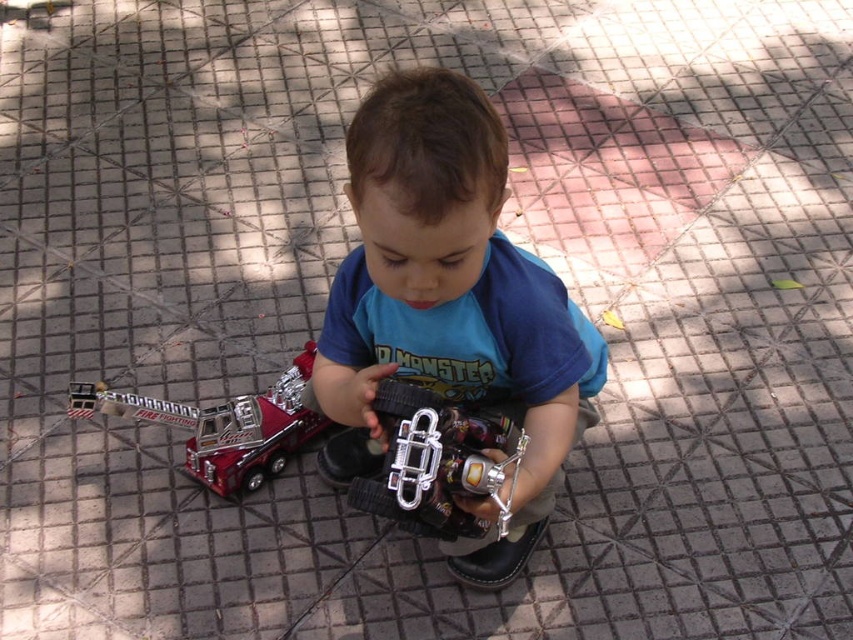
The image size is (853, 640). Identify the location of blue cotton shirt at center. (450, 304).

Is blue cotton shirt at center positioned before metallic red fire truck at lower left?

That is True.

Locate an element on the screen. The width and height of the screenshot is (853, 640). blue cotton shirt at center is located at coordinates (450, 304).